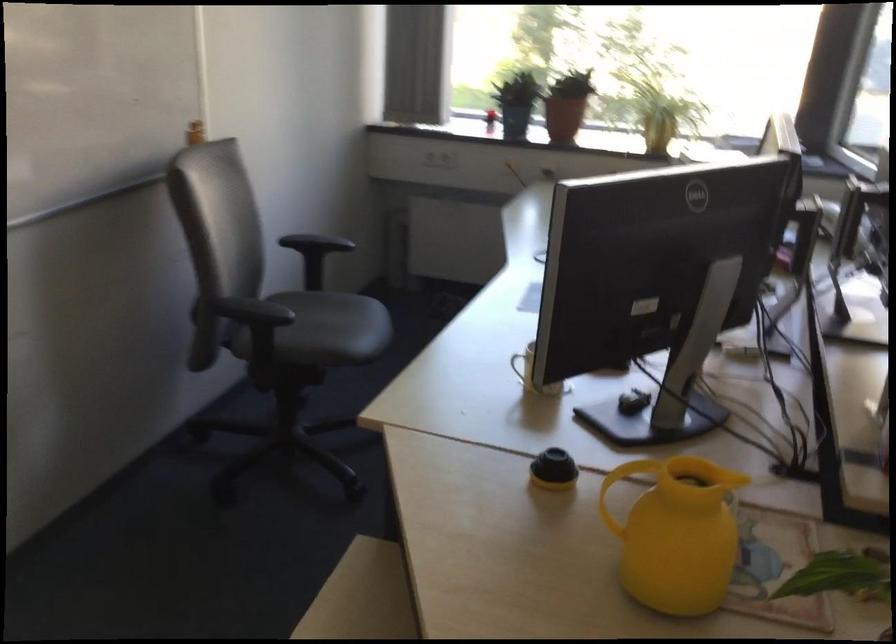
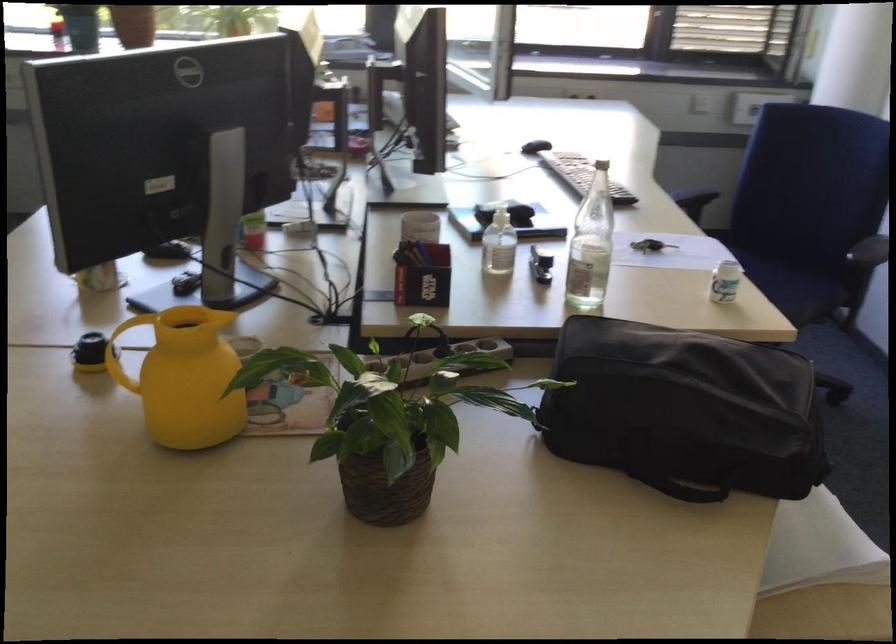
Find the pixel in the second image that matches the point at 685,534 in the first image.

(185, 377)